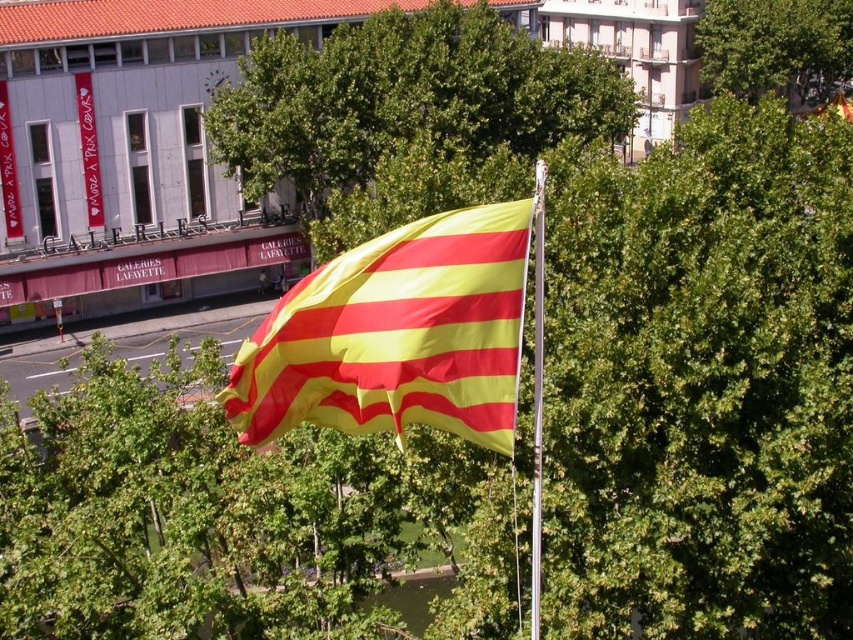
You are standing at the base of the flagpole holding the yellow and red striped flag. You want to place a new decorative light exactly at the point marked by coordinates point (550, 116). How far in meters will this light be from your current position?

The point (550, 116) is 66.36 meters from the viewer, so the light will be 66.36 meters away from your current position at the base of the flagpole.

You are planning to install a new pathway between the green leafy tree at center and the silver metallic flag pole at center. The pathway requires a minimum of 100 feet of space. Based on the scene, will there be enough space to install the pathway?

The distance between the green leafy tree at center and the silver metallic flag pole at center is 111.43 feet, which exceeds the required 100 feet. Therefore, there is sufficient space to install the pathway.

You are standing in front of the Galerie Lafayette building and notice a green leafy tree at upper center and a silver metallic flag pole at center. Which object is positioned to the right of the other?

The green leafy tree at upper center is to the right of the silver metallic flag pole at center.